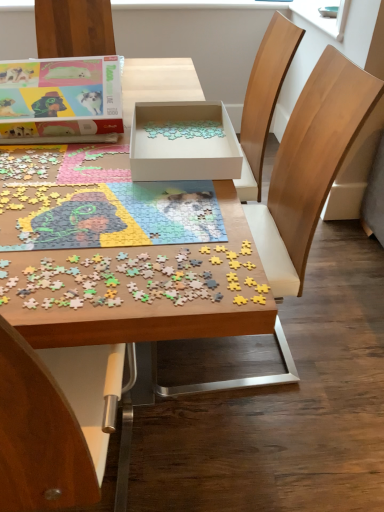
Where is `white cardboard box at center, the 1th box in the right-to-left sequence`? This screenshot has width=384, height=512. white cardboard box at center, the 1th box in the right-to-left sequence is located at coordinates (183, 142).

What do you see at coordinates (109, 215) in the screenshot?
I see `wooden puzzle pieces at center, marked as the second jigsaw puzzle in a front-to-back arrangement` at bounding box center [109, 215].

This screenshot has width=384, height=512. What are the coordinates of `wooden chair at center` in the screenshot? It's located at (309, 166).

The width and height of the screenshot is (384, 512). In order to click on white cardboard box at center, the second box when ordered from left to right in this screenshot , I will do (x=183, y=142).

Considering the positions of points (228, 120) and (318, 182), is point (228, 120) farther from camera compared to point (318, 182)?

Yes, point (228, 120) is farther from viewer.

Considering the relative sizes of white cardboard box at center, the 1th box in the right-to-left sequence, and wooden chair at center in the image provided, is white cardboard box at center, the 1th box in the right-to-left sequence, taller than wooden chair at center?

No, white cardboard box at center, the 1th box in the right-to-left sequence, is not taller than wooden chair at center.

Is wooden chair at center at the back of white cardboard box at center, the second box when ordered from left to right?

That's right, white cardboard box at center, the second box when ordered from left to right, is facing away from wooden chair at center.

In terms of size, does white cardboard box at center, the 1th box in the right-to-left sequence, appear bigger or smaller than wooden chair at center?

In the image, white cardboard box at center, the 1th box in the right-to-left sequence, appears to be smaller than wooden chair at center.

Is wooden puzzle pieces at center positioned beyond the bounds of wooden chair at center?

wooden puzzle pieces at center is positioned outside wooden chair at center.

What are the coordinates of `chair that is above the wooden puzzle pieces at center (from a real-world perspective)` in the screenshot? It's located at (309, 166).

Between wooden puzzle pieces at center and wooden chair at center, which one appears on the right side from the viewer's perspective?

Positioned to the right is wooden chair at center.

From a real-world perspective, is white cardboard box at center, the 1th box in the right-to-left sequence, physically above matte cardboard box at upper left, placed as the 2th box when sorted from right to left?

No, from a real-world perspective, white cardboard box at center, the 1th box in the right-to-left sequence, is not over matte cardboard box at upper left, placed as the 2th box when sorted from right to left

Is white cardboard box at center, the 1th box in the right-to-left sequence, completely or partially outside of matte cardboard box at upper left, placed as the 2th box when sorted from right to left?

Yes, white cardboard box at center, the 1th box in the right-to-left sequence, is outside of matte cardboard box at upper left, placed as the 2th box when sorted from right to left.

Is point (214, 104) farther from viewer compared to point (120, 100)?

Yes, point (214, 104) is behind point (120, 100).

From the image's perspective, is white cardboard box at center, the second box when ordered from left to right, above or below matte cardboard box at upper left, placed as the 2th box when sorted from right to left?

Clearly, from the image's perspective, white cardboard box at center, the second box when ordered from left to right, is below matte cardboard box at upper left, placed as the 2th box when sorted from right to left.

Is white cardboard box at center, the 1th box in the right-to-left sequence, shorter than wooden puzzle pieces at center, the second jigsaw puzzle when ordered from back to front?

No.

Looking at their sizes, would you say white cardboard box at center, the second box when ordered from left to right, is wider or thinner than wooden puzzle pieces at center, which is counted as the 1th jigsaw puzzle, starting from the front?

In the image, white cardboard box at center, the second box when ordered from left to right, appears to be wider than wooden puzzle pieces at center, which is counted as the 1th jigsaw puzzle, starting from the front.

Consider the image. Which of these two, white cardboard box at center, the 1th box in the right-to-left sequence, or wooden puzzle pieces at center, the second jigsaw puzzle when ordered from back to front, is smaller?

wooden puzzle pieces at center, the second jigsaw puzzle when ordered from back to front.

Does point (155, 115) come behind point (180, 266)?

Yes, point (155, 115) is farther from viewer.

From the image's perspective, would you say wooden puzzle pieces at center, which is counted as the 1th jigsaw puzzle, starting from the bottom, is shown under matte cardboard box at upper left, placed as the 2th box when sorted from right to left?

Yes.

Does point (259, 290) appear closer or farther from the camera than point (18, 105)?

Point (259, 290) is closer to the camera than point (18, 105).

Considering the sizes of wooden puzzle pieces at center, which is counted as the 1th jigsaw puzzle, starting from the front, and matte cardboard box at upper left, placed as the first box when sorted from left to right, in the image, is wooden puzzle pieces at center, which is counted as the 1th jigsaw puzzle, starting from the front, bigger or smaller than matte cardboard box at upper left, placed as the first box when sorted from left to right,?

Considering their sizes, wooden puzzle pieces at center, which is counted as the 1th jigsaw puzzle, starting from the front, takes up less space than matte cardboard box at upper left, placed as the first box when sorted from left to right.

Looking at this image, how different are the orientations of wooden puzzle pieces at center, which is counted as the 1th jigsaw puzzle, starting from the front, and matte cardboard box at upper left, placed as the 2th box when sorted from right to left, in degrees?

The facing directions of wooden puzzle pieces at center, which is counted as the 1th jigsaw puzzle, starting from the front, and matte cardboard box at upper left, placed as the 2th box when sorted from right to left, are 177 degrees apart.

Between wooden puzzle pieces at center and wooden puzzle pieces at center, marked as the second jigsaw puzzle in a front-to-back arrangement, which one has smaller size?

wooden puzzle pieces at center, marked as the second jigsaw puzzle in a front-to-back arrangement.

Based on the photo, can wooden puzzle pieces at center, acting as the 1th jigsaw puzzle starting from the top, be found inside wooden puzzle pieces at center?

Indeed, wooden puzzle pieces at center, acting as the 1th jigsaw puzzle starting from the top, is located within wooden puzzle pieces at center.

Between wooden puzzle pieces at center and wooden puzzle pieces at center, acting as the 1th jigsaw puzzle starting from the top, which one appears on the right side from the viewer's perspective?

Positioned to the right is wooden puzzle pieces at center, acting as the 1th jigsaw puzzle starting from the top.

Between wooden puzzle pieces at center and wooden puzzle pieces at center, marked as the second jigsaw puzzle in a front-to-back arrangement, which one is positioned behind?

wooden puzzle pieces at center, marked as the second jigsaw puzzle in a front-to-back arrangement, is more distant.

Would you say wooden chair at center contains matte cardboard box at upper left, placed as the first box when sorted from left to right?

No, matte cardboard box at upper left, placed as the first box when sorted from left to right, is not a part of wooden chair at center.

From the image's perspective, which object appears higher, wooden chair at center or matte cardboard box at upper left, placed as the 2th box when sorted from right to left?

matte cardboard box at upper left, placed as the 2th box when sorted from right to left, is shown above in the image.

From the picture: Is wooden chair at center smaller than matte cardboard box at upper left, placed as the first box when sorted from left to right?

No, wooden chair at center is not smaller than matte cardboard box at upper left, placed as the first box when sorted from left to right.

Find the location of `the 1st box behind the wooden chair at center`. the 1st box behind the wooden chair at center is located at coordinates (183, 142).

Identify the location of chair that appears on the right of wooden puzzle pieces at center. The width and height of the screenshot is (384, 512). (309, 166).

From the image, which object appears to be farther from wooden puzzle pieces at center, which is counted as the second jigsaw puzzle, starting from the top, wooden puzzle pieces at center or white cardboard box at center, the second box when ordered from left to right?

white cardboard box at center, the second box when ordered from left to right, lies further to wooden puzzle pieces at center, which is counted as the second jigsaw puzzle, starting from the top, than the other object.

When comparing their distances from white cardboard box at center, the 1th box in the right-to-left sequence, does wooden chair at center or wooden puzzle pieces at center, which is counted as the 1th jigsaw puzzle, starting from the front, seem closer?

Among the two, wooden chair at center is located nearer to white cardboard box at center, the 1th box in the right-to-left sequence.

Looking at the image, which one is located closer to matte cardboard box at upper left, placed as the 2th box when sorted from right to left, wooden chair at center or wooden puzzle pieces at center, which is counted as the 1th jigsaw puzzle, starting from the front?

wooden chair at center is closer to matte cardboard box at upper left, placed as the 2th box when sorted from right to left.

From the image, which object appears to be nearer to white cardboard box at center, the second box when ordered from left to right, matte cardboard box at upper left, placed as the first box when sorted from left to right, or wooden puzzle pieces at center, arranged as the 1th jigsaw puzzle when viewed from the back?

Based on the image, wooden puzzle pieces at center, arranged as the 1th jigsaw puzzle when viewed from the back, appears to be nearer to white cardboard box at center, the second box when ordered from left to right.

Looking at the image, which one is located closer to wooden puzzle pieces at center, arranged as the 1th jigsaw puzzle when viewed from the back, wooden puzzle pieces at center or wooden chair at center?

Among the two, wooden puzzle pieces at center is located nearer to wooden puzzle pieces at center, arranged as the 1th jigsaw puzzle when viewed from the back.

When comparing their distances from white cardboard box at center, the 1th box in the right-to-left sequence, does wooden puzzle pieces at center, which is counted as the 1th jigsaw puzzle, starting from the front, or matte cardboard box at upper left, placed as the 2th box when sorted from right to left, seem further?

wooden puzzle pieces at center, which is counted as the 1th jigsaw puzzle, starting from the front.

When comparing their distances from white cardboard box at center, the 1th box in the right-to-left sequence, does matte cardboard box at upper left, placed as the first box when sorted from left to right, or wooden chair at center seem closer?

matte cardboard box at upper left, placed as the first box when sorted from left to right.

Based on the photo, when comparing their distances from white cardboard box at center, the second box when ordered from left to right, does wooden puzzle pieces at center, arranged as the 1th jigsaw puzzle when viewed from the back, or wooden chair at center seem further?

The object further to white cardboard box at center, the second box when ordered from left to right, is wooden chair at center.

Locate an element on the screen. Image resolution: width=384 pixels, height=512 pixels. box positioned between wooden puzzle pieces at center and matte cardboard box at upper left, placed as the 2th box when sorted from right to left, from near to far is located at coordinates click(183, 142).

Where is `box between matte cardboard box at upper left, placed as the 2th box when sorted from right to left, and wooden puzzle pieces at center, which is counted as the 1th jigsaw puzzle, starting from the front, from top to bottom`? box between matte cardboard box at upper left, placed as the 2th box when sorted from right to left, and wooden puzzle pieces at center, which is counted as the 1th jigsaw puzzle, starting from the front, from top to bottom is located at coordinates (183, 142).

You are a GUI agent. You are given a task and a screenshot of the screen. Output one action in this format:
    pyautogui.click(x=<x>, y=<y>)
    Task: Click on the jigsaw puzzle between matte cardboard box at upper left, placed as the first box when sorted from left to right, and wooden puzzle pieces at center, which is counted as the 1th jigsaw puzzle, starting from the bottom, in the vertical direction
    
    Given the screenshot: What is the action you would take?
    pyautogui.click(x=109, y=215)

Find the location of a particular element. This screenshot has width=384, height=512. chair between white cardboard box at center, the second box when ordered from left to right, and wooden puzzle pieces at center, which is counted as the 1th jigsaw puzzle, starting from the front, in the vertical direction is located at coordinates (309, 166).